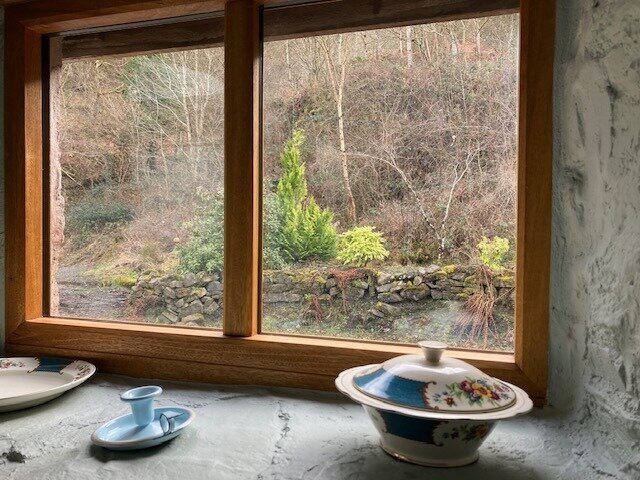
This screenshot has width=640, height=480. I want to click on white plate with blue trim and flowers, so click(x=38, y=380).